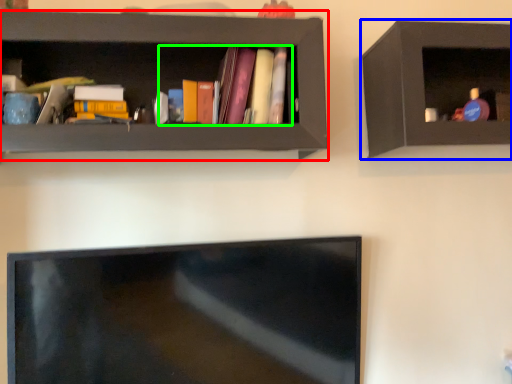
Question: Which object is positioned farthest from shelf (highlighted by a red box)? Select from shelf (highlighted by a blue box) and book (highlighted by a green box).

Choices:
 (A) shelf
 (B) book

Answer: (A)